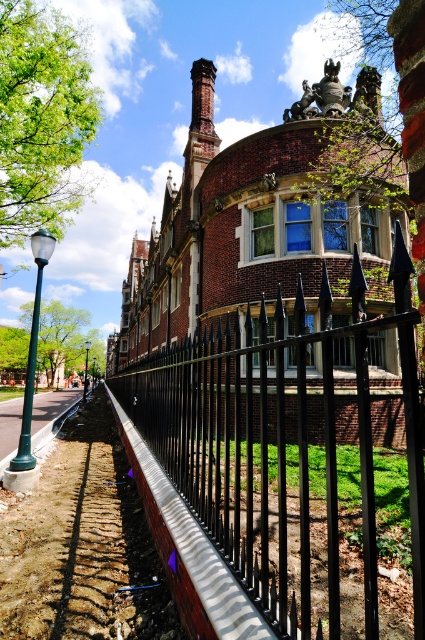
Question: Estimate the real-world distances between objects in this image. Which object is closer to the black wrought iron fence at center?

Choices:
 (A) green leafy tree at left
 (B) smooth concrete pavement at lower left
 (C) green leafy tree at upper center

Answer: (B)

Question: Can you confirm if black wrought iron fence at center is positioned above green leafy tree at left?

Choices:
 (A) yes
 (B) no

Answer: (A)

Question: Does black wrought iron fence at center come in front of green leafy tree at upper center?

Choices:
 (A) yes
 (B) no

Answer: (A)

Question: Which object appears closest to the camera in this image?

Choices:
 (A) smooth concrete pavement at lower left
 (B) green leafy tree at upper left
 (C) black wrought iron fence at center

Answer: (C)

Question: Which point is farther to the camera?

Choices:
 (A) (278, 288)
 (B) (57, 362)

Answer: (B)

Question: Is green leafy tree at upper left bigger than smooth concrete pavement at lower left?

Choices:
 (A) yes
 (B) no

Answer: (B)